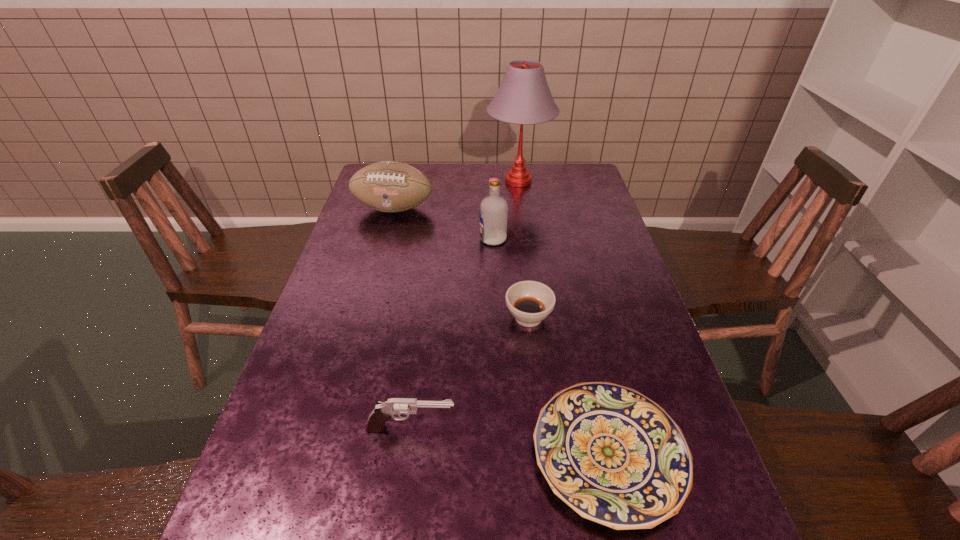
This screenshot has width=960, height=540. What are the coordinates of `table lamp` in the screenshot? It's located at (524, 97).

The image size is (960, 540). I want to click on the fourth nearest object, so click(x=493, y=209).

What are the coordinates of `vodka` in the screenshot? It's located at (493, 209).

Locate an element on the screen. The image size is (960, 540). the third tallest object is located at coordinates (388, 186).

The width and height of the screenshot is (960, 540). In order to click on gun in this screenshot , I will do `click(384, 411)`.

Where is `the fourth farthest object`? the fourth farthest object is located at coordinates (530, 302).

Image resolution: width=960 pixels, height=540 pixels. Find the location of `the second shortest object`. the second shortest object is located at coordinates (530, 302).

Where is `plate`? Image resolution: width=960 pixels, height=540 pixels. plate is located at coordinates (614, 456).

This screenshot has width=960, height=540. Find the location of `blank space located on the front-facing side of the tallest object`. blank space located on the front-facing side of the tallest object is located at coordinates [411, 181].

You are a GUI agent. You are given a task and a screenshot of the screen. Output one action in this format:
    pyautogui.click(x=<x>, y=<y>)
    Task: Click on the blank space located 0.250m on the front-facing side of the tallest object
    
    Given the screenshot: What is the action you would take?
    419,181